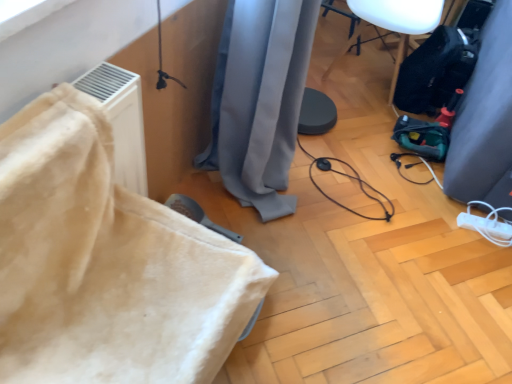
The width and height of the screenshot is (512, 384). What do you see at coordinates (106, 263) in the screenshot? I see `beige fabric couch at left, which appears as the second furniture when viewed from the top` at bounding box center [106, 263].

Image resolution: width=512 pixels, height=384 pixels. What are the coordinates of `gray fabric curtain at right, the first curtain viewed from the right` in the screenshot? It's located at coord(485,120).

Consider the image. How much space does gray fabric curtain at center, marked as the first curtain in a left-to-right arrangement, occupy horizontally?

It is 16.34 inches.

Image resolution: width=512 pixels, height=384 pixels. I want to click on black plastic speaker at upper right, arranged as the 2th furniture when viewed from the front, so click(394, 24).

Measure the distance between black rubber cable at center and camera.

black rubber cable at center is 1.76 meters from camera.

The width and height of the screenshot is (512, 384). I want to click on beige fabric couch at left, which is the second furniture in right-to-left order, so click(x=106, y=263).

Is black rubber cable at center oriented towards black plastic speaker at upper right, arranged as the 2th furniture when viewed from the front?

No, black rubber cable at center is not aimed at black plastic speaker at upper right, arranged as the 2th furniture when viewed from the front.

Which of these two, black rubber cable at center or black plastic speaker at upper right, arranged as the second furniture when ordered from the bottom, is thinner?

black rubber cable at center.

Can you tell me how much black rubber cable at center and black plastic speaker at upper right, arranged as the 2th furniture when viewed from the front, differ in facing direction?

87.4 degrees separate the facing orientations of black rubber cable at center and black plastic speaker at upper right, arranged as the 2th furniture when viewed from the front.

Considering the relative positions of black rubber cable at center and white plastic extension cord at lower right in the image provided, is black rubber cable at center in front of white plastic extension cord at lower right?

Yes.

Locate an element on the screen. The height and width of the screenshot is (384, 512). cable that appears in front of the white plastic extension cord at lower right is located at coordinates (x=350, y=178).

From the image's perspective, would you say black rubber cable at center is shown under white plastic extension cord at lower right?

Incorrect, from the image's perspective, black rubber cable at center is higher than white plastic extension cord at lower right.

Which is in front, point (337, 171) or point (473, 226)?

The point (473, 226) is in front.

Locate an element on the screen. furniture in front of the gray fabric curtain at right, arranged as the second curtain when viewed from the left is located at coordinates (106, 263).

Could you tell me if beige fabric couch at left, marked as the 1th furniture in a front-to-back arrangement, is facing gray fabric curtain at right, the first curtain viewed from the right?

No, beige fabric couch at left, marked as the 1th furniture in a front-to-back arrangement, is not oriented towards gray fabric curtain at right, the first curtain viewed from the right.

From a real-world perspective, which is physically above, beige fabric couch at left, marked as the 1th furniture in a front-to-back arrangement, or gray fabric curtain at right, the first curtain viewed from the right?

beige fabric couch at left, marked as the 1th furniture in a front-to-back arrangement, is physically above.

Considering the relative positions of beige fabric couch at left, arranged as the first furniture when viewed from the left, and gray fabric curtain at right, arranged as the second curtain when viewed from the left, in the image provided, is beige fabric couch at left, arranged as the first furniture when viewed from the left, in front of gray fabric curtain at right, arranged as the second curtain when viewed from the left,?

Yes, it is.

In the image, there is a black rubber cable at center. Where is `extension cord below it (from the image's perspective)`? The image size is (512, 384). extension cord below it (from the image's perspective) is located at coordinates (485, 226).

Can you tell me how much white plastic extension cord at lower right and black rubber cable at center differ in facing direction?

78.4 degrees.

Which of these two, white plastic extension cord at lower right or black rubber cable at center, is wider?

black rubber cable at center is wider.

Which is more to the left, white plastic extension cord at lower right or black rubber cable at center?

black rubber cable at center is more to the left.

Is point (329, 69) positioned after point (222, 65)?

Yes, point (329, 69) is farther from viewer.

Does black plastic speaker at upper right, positioned as the first furniture in back-to-front order, have a greater height compared to gray fabric curtain at center, which appears as the second curtain when viewed from the right?

In fact, black plastic speaker at upper right, positioned as the first furniture in back-to-front order, may be shorter than gray fabric curtain at center, which appears as the second curtain when viewed from the right.

Which is more to the right, black plastic speaker at upper right, arranged as the 2th furniture when viewed from the front, or gray fabric curtain at center, marked as the first curtain in a left-to-right arrangement?

black plastic speaker at upper right, arranged as the 2th furniture when viewed from the front, is more to the right.

Looking at the image, does black plastic speaker at upper right, the first furniture in the top-to-bottom sequence, seem bigger or smaller compared to gray fabric curtain at center, marked as the first curtain in a left-to-right arrangement?

Considering their sizes, black plastic speaker at upper right, the first furniture in the top-to-bottom sequence, takes up less space than gray fabric curtain at center, marked as the first curtain in a left-to-right arrangement.

Which object is closer to the camera, beige fabric couch at left, the second furniture in the back-to-front sequence, or black plastic speaker at upper right, arranged as the 2th furniture when viewed from the front?

beige fabric couch at left, the second furniture in the back-to-front sequence, is closer to the camera.

Considering the sizes of beige fabric couch at left, marked as the 1th furniture in a bottom-to-top arrangement, and black plastic speaker at upper right, arranged as the second furniture when ordered from the bottom, in the image, is beige fabric couch at left, marked as the 1th furniture in a bottom-to-top arrangement, taller or shorter than black plastic speaker at upper right, arranged as the second furniture when ordered from the bottom,?

Clearly, beige fabric couch at left, marked as the 1th furniture in a bottom-to-top arrangement, is shorter compared to black plastic speaker at upper right, arranged as the second furniture when ordered from the bottom.

In order to click on furniture lying above the beige fabric couch at left, marked as the 1th furniture in a front-to-back arrangement (from the image's perspective) in this screenshot , I will do `click(394, 24)`.

Does point (174, 378) lie in front of point (416, 7)?

Yes.

Is white plastic extension cord at lower right turned away from gray fabric curtain at right, arranged as the second curtain when viewed from the left?

Yes.

How many degrees apart are the facing directions of white plastic extension cord at lower right and gray fabric curtain at right, the first curtain viewed from the right?

80.2 degrees separate the facing orientations of white plastic extension cord at lower right and gray fabric curtain at right, the first curtain viewed from the right.

Which is further, (506,231) or (503,102)?

The point (506,231) is behind.

Is white plastic extension cord at lower right touching gray fabric curtain at right, arranged as the second curtain when viewed from the left?

No, white plastic extension cord at lower right is not in contact with gray fabric curtain at right, arranged as the second curtain when viewed from the left.

Identify the location of cable lying in front of the black plastic speaker at upper right, arranged as the 2th furniture when viewed from the left. The image size is (512, 384). (350, 178).

The height and width of the screenshot is (384, 512). Find the location of `cable below the white plastic extension cord at lower right (from a real-world perspective)`. cable below the white plastic extension cord at lower right (from a real-world perspective) is located at coordinates (350, 178).

From the image, which object appears to be farther from black rubber cable at center, black plastic speaker at upper right, positioned as the first furniture in back-to-front order, or gray fabric curtain at right, the first curtain viewed from the right?

black plastic speaker at upper right, positioned as the first furniture in back-to-front order.

Which object lies further to the anchor point black plastic speaker at upper right, arranged as the second furniture when ordered from the bottom, white plastic extension cord at lower right or black rubber cable at center?

white plastic extension cord at lower right is further to black plastic speaker at upper right, arranged as the second furniture when ordered from the bottom.

Which object lies further to the anchor point gray fabric curtain at right, the first curtain viewed from the right, beige fabric couch at left, marked as the 1th furniture in a bottom-to-top arrangement, or white plastic extension cord at lower right?

beige fabric couch at left, marked as the 1th furniture in a bottom-to-top arrangement, lies further to gray fabric curtain at right, the first curtain viewed from the right, than the other object.

Estimate the real-world distances between objects in this image. Which object is closer to gray fabric curtain at center, marked as the first curtain in a left-to-right arrangement, beige fabric couch at left, the second furniture in the back-to-front sequence, or gray fabric curtain at right, the first curtain viewed from the right?

beige fabric couch at left, the second furniture in the back-to-front sequence.

Considering their positions, is black rubber cable at center positioned closer to gray fabric curtain at right, the first curtain viewed from the right, than black plastic speaker at upper right, arranged as the 2th furniture when viewed from the left?

Among the two, black rubber cable at center is located nearer to gray fabric curtain at right, the first curtain viewed from the right.

From the picture: Which object lies nearer to the anchor point gray fabric curtain at right, the first curtain viewed from the right, gray fabric curtain at center, marked as the first curtain in a left-to-right arrangement, or black rubber cable at center?

black rubber cable at center.

Which object lies nearer to the anchor point black rubber cable at center, white plastic extension cord at lower right or gray fabric curtain at right, arranged as the second curtain when viewed from the left?

Based on the image, white plastic extension cord at lower right appears to be nearer to black rubber cable at center.

When comparing their distances from black plastic speaker at upper right, arranged as the 2th furniture when viewed from the front, does gray fabric curtain at center, which appears as the second curtain when viewed from the right, or white plastic extension cord at lower right seem closer?

gray fabric curtain at center, which appears as the second curtain when viewed from the right, lies closer to black plastic speaker at upper right, arranged as the 2th furniture when viewed from the front, than the other object.

This screenshot has height=384, width=512. Identify the location of furniture between gray fabric curtain at center, marked as the first curtain in a left-to-right arrangement, and gray fabric curtain at right, the first curtain viewed from the right. (394, 24).

Identify the location of extension cord between beige fabric couch at left, the second furniture in the back-to-front sequence, and gray fabric curtain at right, the first curtain viewed from the right, in the horizontal direction. (485, 226).

Where is `cable located between beige fabric couch at left, which is the second furniture in right-to-left order, and gray fabric curtain at right, the first curtain viewed from the right, in the left-right direction`? This screenshot has height=384, width=512. cable located between beige fabric couch at left, which is the second furniture in right-to-left order, and gray fabric curtain at right, the first curtain viewed from the right, in the left-right direction is located at coordinates (350, 178).

The width and height of the screenshot is (512, 384). I want to click on cable between gray fabric curtain at center, which appears as the second curtain when viewed from the right, and white plastic extension cord at lower right in the front-back direction, so click(x=350, y=178).